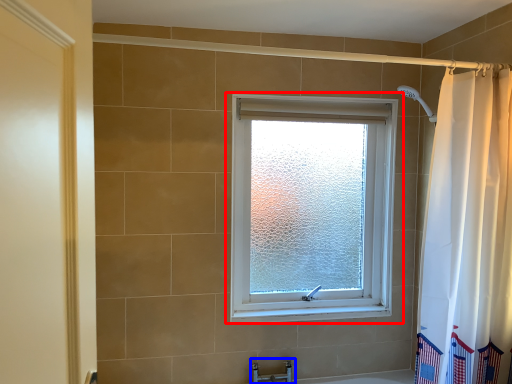
Question: Which point is closer to the camera, window (highlighted by a red box) or faucet (highlighted by a blue box)?

Choices:
 (A) window
 (B) faucet

Answer: (A)